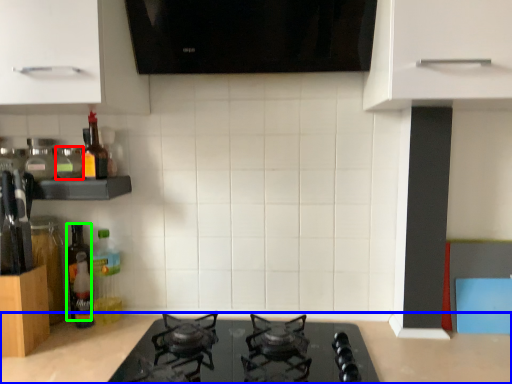
Question: Estimate the real-world distances between objects in this image. Which object is farther from bottle (highlighted by a red box), countertop (highlighted by a blue box) or bottle (highlighted by a green box)?

Choices:
 (A) countertop
 (B) bottle

Answer: (A)